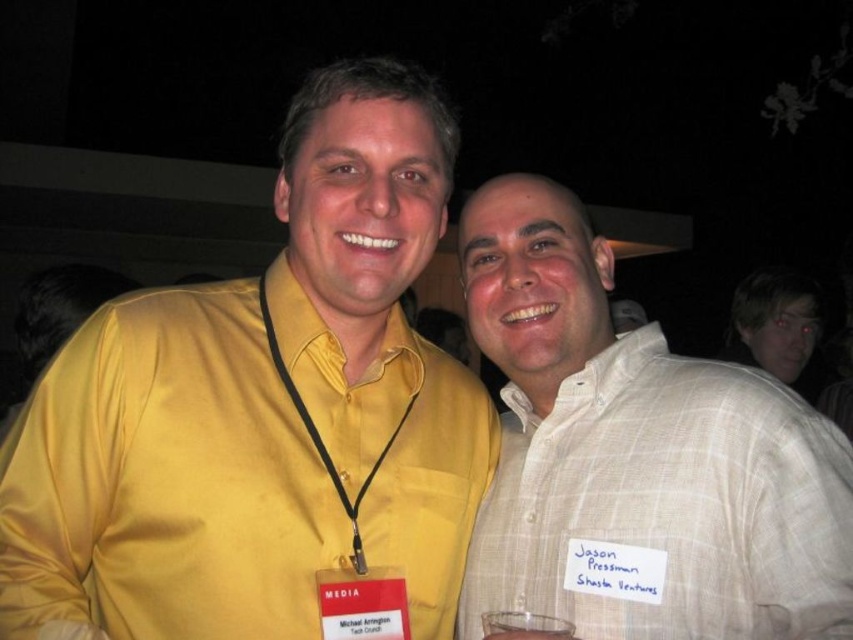
You are organizing a photo shoot and need to ensure that the two shirts at the right side of the image are visible in the frame. Given that the camera can only capture objects up to 2 meters in width, will both the white checkered shirt at right and the light brown plaid shirt at right fit within the camera frame?

The white checkered shirt at right is bigger than the light brown plaid shirt at right. Since the camera can capture up to 2 meters, and the larger shirt is still within that limit, both shirts will fit within the camera frame.

You are organizing a photo shoot and need to ensure that the clear glass at lower center is visible in the final image. Given that the light brown plaid shirt at right is covering it, how can you adjust the positioning of the shirt to make the glass visible?

The light brown plaid shirt at right is positioned over the clear glass at lower center. To make the glass visible, you should move the light brown plaid shirt at right to the side or lower it so it no longer covers the glass.

You are at an event and want to hand a note to the person wearing the white checkered shirt at right. You are standing behind the clear glass at lower center. Can you reach them without moving past the glass?

The white checkered shirt at right is located above the clear glass at lower center, so you can reach them by extending your arm over the glass since they are positioned higher than the glass.